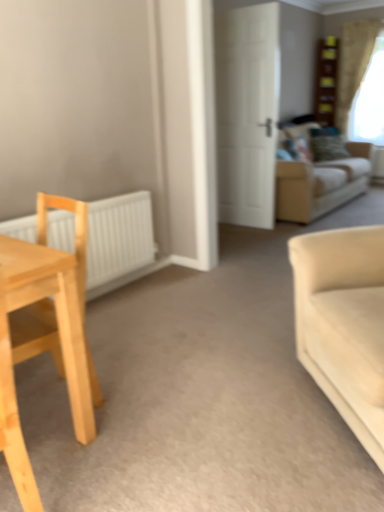
Question: From a real-world perspective, is white matte door at center located higher than beige fabric couch at upper right, arranged as the second studio couch when ordered from the bottom?

Choices:
 (A) yes
 (B) no

Answer: (A)

Question: Does white matte door at center have a lesser width compared to beige fabric couch at upper right, the first studio couch from the top?

Choices:
 (A) yes
 (B) no

Answer: (A)

Question: Would you consider white matte door at center to be distant from beige fabric couch at upper right, the second studio couch viewed from the front?

Choices:
 (A) yes
 (B) no

Answer: (B)

Question: Considering the relative sizes of white matte door at center and beige fabric couch at upper right, the first studio couch from the top, in the image provided, is white matte door at center taller than beige fabric couch at upper right, the first studio couch from the top,?

Choices:
 (A) yes
 (B) no

Answer: (A)

Question: Is white matte door at center looking in the opposite direction of beige fabric couch at upper right, the second studio couch viewed from the front?

Choices:
 (A) yes
 (B) no

Answer: (A)

Question: Is white matte door at center smaller than beige fabric couch at upper right, arranged as the 1th studio couch when viewed from the back?

Choices:
 (A) yes
 (B) no

Answer: (A)

Question: From the image's perspective, is green textured pillow at upper right located beneath white matte door at center?

Choices:
 (A) no
 (B) yes

Answer: (A)

Question: Is green textured pillow at upper right next to white matte door at center and touching it?

Choices:
 (A) no
 (B) yes

Answer: (A)

Question: Does green textured pillow at upper right turn towards white matte door at center?

Choices:
 (A) no
 (B) yes

Answer: (A)

Question: Can you confirm if green textured pillow at upper right is thinner than white matte door at center?

Choices:
 (A) yes
 (B) no

Answer: (B)

Question: Considering the relative positions of green textured pillow at upper right and white matte door at center in the image provided, is green textured pillow at upper right to the left of white matte door at center from the viewer's perspective?

Choices:
 (A) yes
 (B) no

Answer: (B)

Question: Can you confirm if green textured pillow at upper right is shorter than white matte door at center?

Choices:
 (A) yes
 (B) no

Answer: (A)

Question: Is light wood chair at left not close to white matte radiator at left?

Choices:
 (A) no
 (B) yes

Answer: (B)